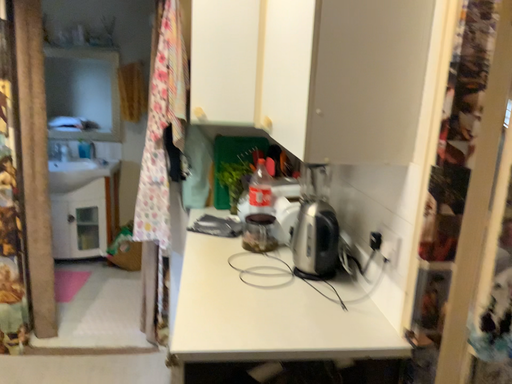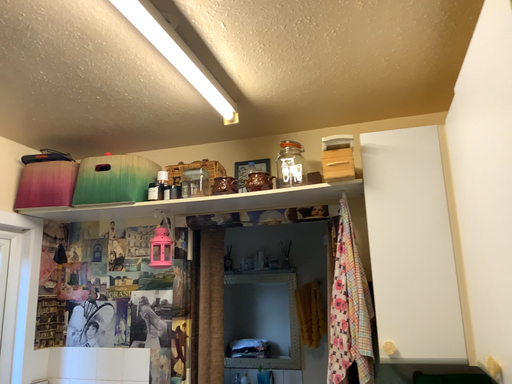
Question: Which way did the camera rotate in the video?

Choices:
 (A) rotated left
 (B) rotated right

Answer: (A)